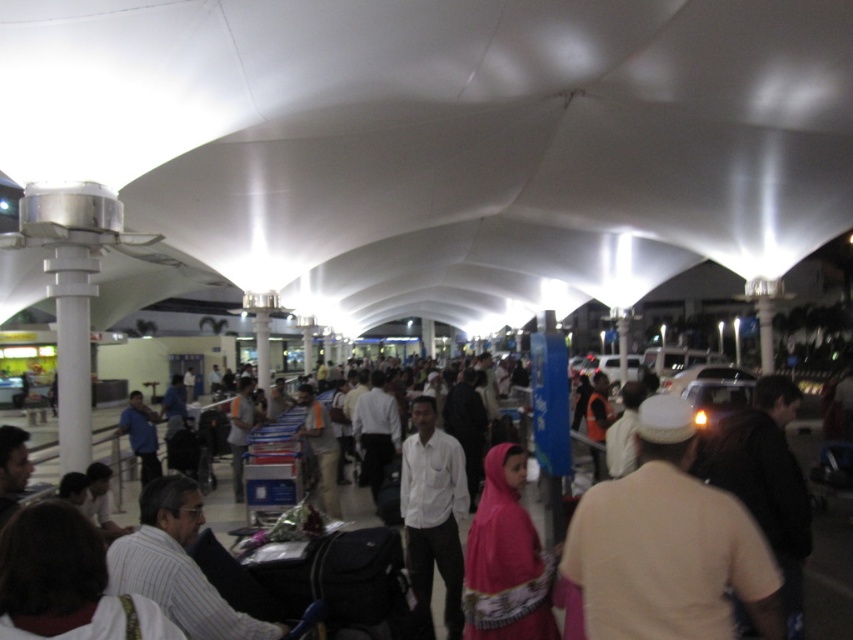
Question: Where is white striped shirt at lower left located in relation to brown fabric backpack at right in the image?

Choices:
 (A) left
 (B) right

Answer: (A)

Question: Which point appears closest to the camera in this image?

Choices:
 (A) (758, 481)
 (B) (730, 605)
 (C) (520, 600)

Answer: (B)

Question: Which object is closer to the camera taking this photo?

Choices:
 (A) white striped shirt at lower left
 (B) beige cotton shirt at center
 (C) brown fabric backpack at right

Answer: (A)

Question: Which is nearer to the beige cotton shirt at center?

Choices:
 (A) white striped shirt at lower left
 (B) brown fabric backpack at right
 (C) pink satin dress at center

Answer: (B)

Question: Can you confirm if beige cotton shirt at center is positioned to the right of pink satin dress at center?

Choices:
 (A) no
 (B) yes

Answer: (B)

Question: Is beige cotton shirt at center below brown fabric backpack at right?

Choices:
 (A) no
 (B) yes

Answer: (A)